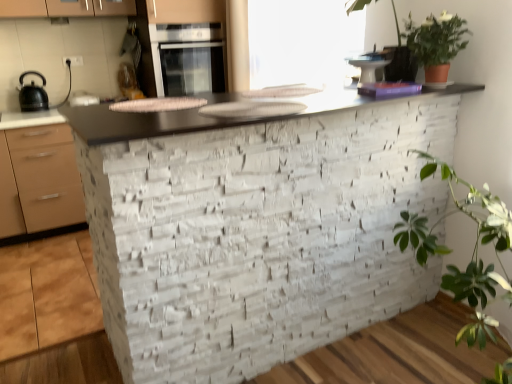
Measure the distance between matte beige cabinetry at upper center and camera.

2.89 meters.

What is the approximate height of green matte plant at upper right?

It is 10.97 inches.

The image size is (512, 384). What do you see at coordinates (436, 43) in the screenshot? I see `green matte plant at upper right` at bounding box center [436, 43].

What is the approximate width of transparent plastic window screen at upper center?

The width of transparent plastic window screen at upper center is 9.68 inches.

At what (x,y) coordinates should I click in order to perform the action: click on matte beige cabinetry at upper center. Please return your answer as a coordinate pair (x, y). Image resolution: width=512 pixels, height=384 pixels. Looking at the image, I should click on (185, 11).

This screenshot has width=512, height=384. I want to click on houseplant above the satin silver oven at upper center (from a real-world perspective), so click(x=434, y=42).

Considering the relative sizes of green leafy plant at upper right and satin silver oven at upper center in the image provided, is green leafy plant at upper right wider than satin silver oven at upper center?

No.

Is green leafy plant at upper right positioned beyond the bounds of satin silver oven at upper center?

Indeed, green leafy plant at upper right is completely outside satin silver oven at upper center.

Does green leafy plant at upper right have a larger size compared to satin silver oven at upper center?

No.

From a real-world perspective, which is physically above, white glossy bowl at upper center or smooth stone countertop at center?

white glossy bowl at upper center.

From the image's perspective, relative to smooth stone countertop at center, is white glossy bowl at upper center above or below?

Clearly, from the image's perspective, white glossy bowl at upper center is above smooth stone countertop at center.

Can you confirm if white glossy bowl at upper center is shorter than smooth stone countertop at center?

Indeed, white glossy bowl at upper center has a lesser height compared to smooth stone countertop at center.

Is point (366, 70) more distant than point (446, 94)?

Yes, it is behind point (446, 94).

Is white glossy bowl at upper center positioned beyond the bounds of transparent plastic window screen at upper center?

Yes.

Does white glossy bowl at upper center turn towards transparent plastic window screen at upper center?

Yes, white glossy bowl at upper center is oriented towards transparent plastic window screen at upper center.

Looking at this image, from a real-world perspective, is white glossy bowl at upper center above or below transparent plastic window screen at upper center?

white glossy bowl at upper center is situated lower than transparent plastic window screen at upper center in the real world.

From the image's perspective, is satin silver oven at upper center on green matte plant at upper right?

Correct, satin silver oven at upper center appears higher than green matte plant at upper right in the image.

Is the position of satin silver oven at upper center less distant than that of green matte plant at upper right?

No, satin silver oven at upper center is behind green matte plant at upper right.

From a real-world perspective, is satin silver oven at upper center located beneath green matte plant at upper right?

Yes, from a real-world perspective, satin silver oven at upper center is under green matte plant at upper right.

Where is `oven below the green matte plant at upper right (from a real-world perspective)`? oven below the green matte plant at upper right (from a real-world perspective) is located at coordinates (188, 58).

Is green matte plant at upper right far from satin silver oven at upper center?

Absolutely, green matte plant at upper right is distant from satin silver oven at upper center.

Considering the sizes of objects green matte plant at upper right and satin silver oven at upper center in the image provided, who is smaller, green matte plant at upper right or satin silver oven at upper center?

green matte plant at upper right is smaller.

From the picture: Considering the positions of objects green matte plant at upper right and satin silver oven at upper center in the image provided, who is in front, green matte plant at upper right or satin silver oven at upper center?

green matte plant at upper right.

Which object is positioned more to the left, transparent plastic window screen at upper center or satin silver oven at upper center?

Positioned to the left is satin silver oven at upper center.

Is point (270, 39) closer or farther from the camera than point (193, 47)?

Point (270, 39) is closer to the camera than point (193, 47).

Based on their sizes in the image, would you say transparent plastic window screen at upper center is bigger or smaller than satin silver oven at upper center?

Considering their sizes, transparent plastic window screen at upper center takes up less space than satin silver oven at upper center.

From a real-world perspective, is transparent plastic window screen at upper center positioned above or below satin silver oven at upper center?

transparent plastic window screen at upper center is situated higher than satin silver oven at upper center in the real world.

Is white stone sink at center taller or shorter than smooth stone countertop at center?

In the image, white stone sink at center appears to be shorter than smooth stone countertop at center.

From a real-world perspective, is white stone sink at center located higher than smooth stone countertop at center?

Yes, from a real-world perspective, white stone sink at center is on top of smooth stone countertop at center.

From the image's perspective, between white stone sink at center and smooth stone countertop at center, which one is located above?

white stone sink at center, from the image's perspective.

In order to click on houseplant below the satin silver oven at upper center (from the image's perspective) in this screenshot , I will do `click(434, 42)`.

There is a smooth stone countertop at center. Where is `appliance above it (from a real-world perspective)`? appliance above it (from a real-world perspective) is located at coordinates (367, 68).

Looking at this image, which object lies further to the anchor point white glossy bowl at upper center, smooth stone countertop at center or green matte plant at upper right?

smooth stone countertop at center is positioned further to the anchor white glossy bowl at upper center.

Looking at the image, which one is located closer to matte black kettle at left, transparent plastic window screen at upper center or white glossy bowl at upper center?

transparent plastic window screen at upper center.

From the image, which object appears to be farther from matte beige cabinetry at upper center, transparent plastic window screen at upper center or white glossy bowl at upper center?

white glossy bowl at upper center.

Estimate the real-world distances between objects in this image. Which object is further from smooth stone countertop at center, white glossy bowl at upper center or green leafy plant at upper right?

white glossy bowl at upper center lies further to smooth stone countertop at center than the other object.

Looking at the image, which one is located closer to white glossy bowl at upper center, transparent plastic window screen at upper center or white stone sink at center?

The object closer to white glossy bowl at upper center is white stone sink at center.

Considering their positions, is green matte plant at upper right positioned further to white glossy bowl at upper center than smooth stone countertop at center?

smooth stone countertop at center is positioned further to the anchor white glossy bowl at upper center.

Looking at the image, which one is located further to green leafy plant at upper right, green matte plant at upper right or transparent plastic window screen at upper center?

transparent plastic window screen at upper center is positioned further to the anchor green leafy plant at upper right.

Based on their spatial positions, is white stone sink at center or matte beige cabinetry at upper center closer to green matte plant at upper right?

white stone sink at center is positioned closer to the anchor green matte plant at upper right.

Where is `vegetation between smooth stone countertop at center and matte beige cabinetry at upper center in the front-back direction`? vegetation between smooth stone countertop at center and matte beige cabinetry at upper center in the front-back direction is located at coordinates (436, 43).

I want to click on vegetation located between white stone sink at center and transparent plastic window screen at upper center in the depth direction, so click(436, 43).

The height and width of the screenshot is (384, 512). Identify the location of window screen between smooth stone countertop at center and satin silver oven at upper center in the front-back direction. (302, 42).

This screenshot has width=512, height=384. Identify the location of window screen between matte beige cabinetry at upper center and white glossy bowl at upper center. click(302, 42).